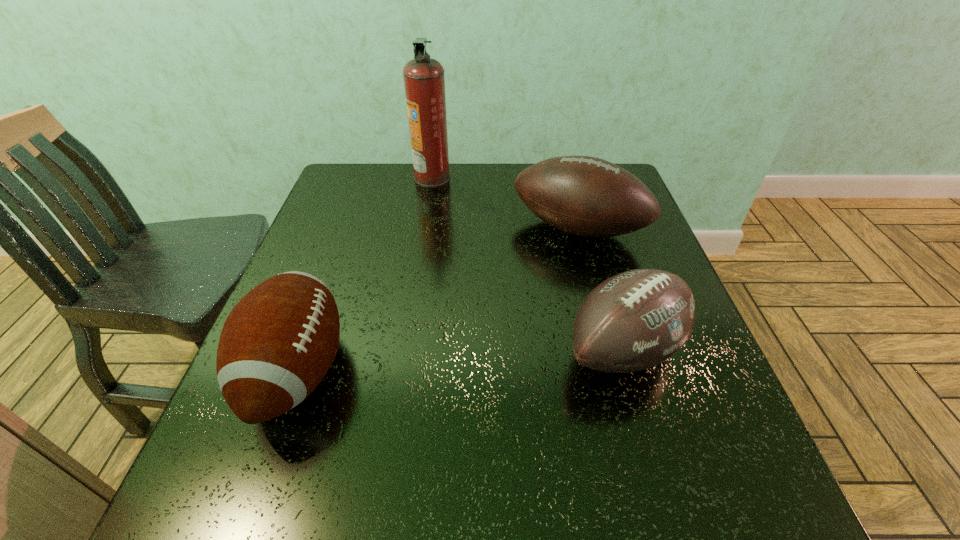
At what (x,y) coordinates should I click in order to perform the action: click on object located in the far right corner section of the desktop. Please return your answer as a coordinate pair (x, y). This screenshot has width=960, height=540. Looking at the image, I should click on (586, 196).

In the image, there is a desktop. Identify the location of vacant space at the near edge. (656, 510).

At what (x,y) coordinates should I click in order to perform the action: click on vacant area at the left edge of the desktop. Please return your answer as a coordinate pair (x, y). Looking at the image, I should click on (336, 244).

In the image, there is a desktop. At what (x,y) coordinates should I click in order to perform the action: click on free space at the right edge. Please return your answer as a coordinate pair (x, y). The image size is (960, 540). Looking at the image, I should click on (720, 455).

Where is `unoccupied area between the leftmost object and the farthest football (American)`? unoccupied area between the leftmost object and the farthest football (American) is located at coordinates (438, 300).

This screenshot has width=960, height=540. Identify the location of empty location between the third object from right to left and the leftmost football (American). (365, 274).

Identify the location of vacant area between the farthest football (American) and the tallest object. (505, 203).

Where is `vacant area that lies between the farthest football (American) and the tallest object`? vacant area that lies between the farthest football (American) and the tallest object is located at coordinates (505, 203).

Identify the location of free space between the farthest object and the farthest football (American). The width and height of the screenshot is (960, 540). tap(505, 203).

The image size is (960, 540). I want to click on empty space that is in between the tallest object and the farthest football (American), so click(505, 203).